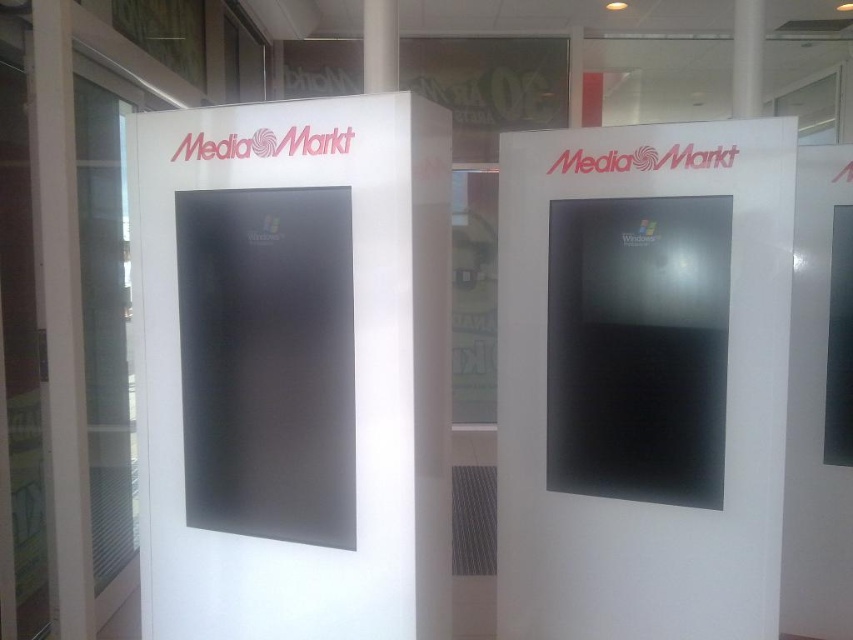
You are standing in front of the two kiosks and want to touch both the satin black monitor at center and the white glossy display at center. Which one do you need to reach out further to touch?

You need to reach out further to touch the white glossy display at center because it is farther from the viewer compared to the satin black monitor at center.

You are a customer looking at the two items in the center of the kiosks. Which item is positioned higher up between the satin black monitor at center and the white glossy display at center?

The satin black monitor at center is located above the white glossy display at center, so it is positioned higher up.

Looking at this image, you are a customer in a store and want to see the display on the satin black monitor at center. However, there is a white matte pillar at center blocking your view. Can you move around the pillar to see the monitor?

The satin black monitor at center is below the white matte pillar at center, so you can move around the pillar to see the monitor since it is positioned lower than the pillar.